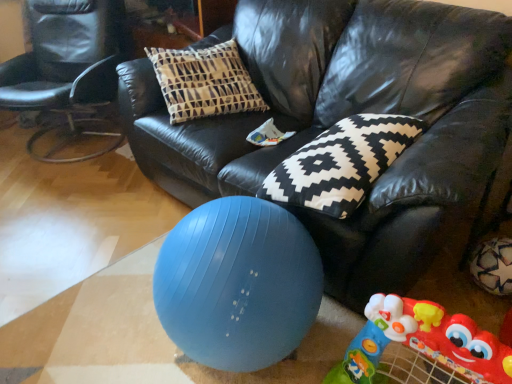
You are a GUI agent. You are given a task and a screenshot of the screen. Output one action in this format:
    pyautogui.click(x=<x>, y=<y>)
    Task: Click on the black leather chair at left
    
    Given the screenshot: What is the action you would take?
    pyautogui.click(x=67, y=62)

Locate an element on the screen. blue rubber ball at lower center is located at coordinates (238, 284).

At what (x,y) coordinates should I click in order to perform the action: click on black leather chair at left. Please return your answer as a coordinate pair (x, y). The height and width of the screenshot is (384, 512). Looking at the image, I should click on (67, 62).

Who is bigger, black leather chair at left or black and white patterned pillow at center?

Bigger between the two is black leather chair at left.

Looking at this image, is black and white patterned pillow at center inside black leather chair at left?

No, black and white patterned pillow at center is not surrounded by black leather chair at left.

Is black leather chair at left far from black and white patterned pillow at center?

Yes, black leather chair at left and black and white patterned pillow at center are located far from each other.

From the image's perspective, which is below, black leather chair at left or black and white patterned pillow at center?

black and white patterned pillow at center is shown below in the image.

From their relative heights in the image, would you say black and white patterned pillow at center is taller or shorter than black leather couch at center?

black and white patterned pillow at center is shorter than black leather couch at center.

Is black and white patterned pillow at center to the left of black leather couch at center from the viewer's perspective?

Incorrect, black and white patterned pillow at center is not on the left side of black leather couch at center.

The width and height of the screenshot is (512, 384). In order to click on studio couch lying on the left of black and white patterned pillow at center in this screenshot , I will do `click(346, 116)`.

Is point (381, 274) farther from camera compared to point (364, 341)?

Yes.

Where is `studio couch lying behind the rubberized plastic walker at lower right`? studio couch lying behind the rubberized plastic walker at lower right is located at coordinates (346, 116).

Which is correct: black leather couch at center is inside rubberized plastic walker at lower right, or outside of it?

black leather couch at center lies outside rubberized plastic walker at lower right.

How different are the orientations of black leather couch at center and rubberized plastic walker at lower right in degrees?

The angular difference between black leather couch at center and rubberized plastic walker at lower right is 6.59 degrees.

Does rubberized plastic walker at lower right turn towards blue rubber ball at lower center?

No, rubberized plastic walker at lower right is not aimed at blue rubber ball at lower center.

Considering their positions, is rubberized plastic walker at lower right located in front of or behind blue rubber ball at lower center?

rubberized plastic walker at lower right is positioned closer to the viewer than blue rubber ball at lower center.

Is rubberized plastic walker at lower right completely or partially outside of blue rubber ball at lower center?

Yes, rubberized plastic walker at lower right is outside of blue rubber ball at lower center.

Is point (366, 306) closer or farther from the camera than point (320, 303)?

Point (366, 306) is closer to the camera than point (320, 303).

From a real-world perspective, which object rests below the other?

From a 3D spatial view, black leather chair at left is below.

Is black leather chair at left smaller than black leather couch at center?

Indeed, black leather chair at left has a smaller size compared to black leather couch at center.

In the scene shown: Considering their positions, is black leather chair at left located in front of or behind black leather couch at center?

Clearly, black leather chair at left is behind black leather couch at center.

Is black leather chair at left positioned with its back to black leather couch at center?

No.

From the image's perspective, is black leather couch at center beneath black and white patterned pillow at center?

No, from the image's perspective, black leather couch at center is not below black and white patterned pillow at center.

In terms of height, does black leather couch at center look taller or shorter compared to black and white patterned pillow at center?

In the image, black leather couch at center appears to be taller than black and white patterned pillow at center.

The width and height of the screenshot is (512, 384). I want to click on pillow on the right of black leather couch at center, so click(x=341, y=163).

Does point (266, 266) appear closer or farther from the camera than point (300, 159)?

Clearly, point (266, 266) is closer to the camera than point (300, 159).

From the picture: Considering the sizes of blue rubber ball at lower center and black and white patterned pillow at center in the image, is blue rubber ball at lower center taller or shorter than black and white patterned pillow at center?

Clearly, blue rubber ball at lower center is taller compared to black and white patterned pillow at center.

Would you consider blue rubber ball at lower center to be distant from black and white patterned pillow at center?

No.

From the image's perspective, which object appears higher, blue rubber ball at lower center or black and white patterned pillow at center?

black and white patterned pillow at center appears higher in the image.

At what (x,y) coordinates should I click in order to perform the action: click on chair behind the black and white patterned pillow at center. Please return your answer as a coordinate pair (x, y). Looking at the image, I should click on (67, 62).

What are the coordinates of `studio couch above the black and white patterned pillow at center (from the image's perspective)` in the screenshot? It's located at (346, 116).

Based on their spatial positions, is rubberized plastic walker at lower right or black and white patterned pillow at center further from black leather couch at center?

rubberized plastic walker at lower right is positioned further to the anchor black leather couch at center.

When comparing their distances from blue rubber ball at lower center, does rubberized plastic walker at lower right or black and white patterned pillow at center seem further?

rubberized plastic walker at lower right.

Estimate the real-world distances between objects in this image. Which object is further from black leather chair at left, blue rubber ball at lower center or black leather couch at center?

Based on the image, blue rubber ball at lower center appears to be further to black leather chair at left.

From the image, which object appears to be farther from black leather chair at left, black leather couch at center or rubberized plastic walker at lower right?

rubberized plastic walker at lower right is positioned further to the anchor black leather chair at left.

Estimate the real-world distances between objects in this image. Which object is further from blue rubber ball at lower center, black and white patterned pillow at center or black leather chair at left?

Among the two, black leather chair at left is located further to blue rubber ball at lower center.

From the image, which object appears to be nearer to black and white patterned pillow at center, rubberized plastic walker at lower right or black leather couch at center?

black leather couch at center.

From the image, which object appears to be nearer to blue rubber ball at lower center, black leather couch at center or rubberized plastic walker at lower right?

Among the two, rubberized plastic walker at lower right is located nearer to blue rubber ball at lower center.

Looking at the image, which one is located further to blue rubber ball at lower center, black leather couch at center or black and white patterned pillow at center?

Based on the image, black leather couch at center appears to be further to blue rubber ball at lower center.

The image size is (512, 384). Find the location of `ball between black and white patterned pillow at center and rubberized plastic walker at lower right in the up-down direction`. ball between black and white patterned pillow at center and rubberized plastic walker at lower right in the up-down direction is located at coordinates (238, 284).

I want to click on ball between black leather chair at left and rubberized plastic walker at lower right, so click(x=238, y=284).

Locate an element on the screen. pillow between black leather couch at center and blue rubber ball at lower center from top to bottom is located at coordinates (341, 163).

The image size is (512, 384). In order to click on ball situated between black leather chair at left and black and white patterned pillow at center from left to right in this screenshot , I will do `click(238, 284)`.